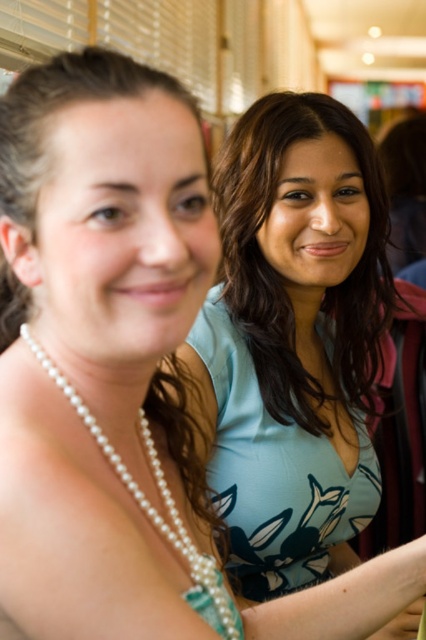
Can you confirm if pearl necklace at left is taller than pearl necklace at center?

No, pearl necklace at left is not taller than pearl necklace at center.

Is pearl necklace at left wider than pearl necklace at center?

Yes, pearl necklace at left is wider than pearl necklace at center.

Locate an element on the screen. pearl necklace at left is located at coordinates (65, 108).

This screenshot has width=426, height=640. Find the location of `pearl necklace at left`. pearl necklace at left is located at coordinates (65, 108).

Where is `matte blue blouse at center`? The image size is (426, 640). matte blue blouse at center is located at coordinates (279, 275).

Is matte blue blouse at center positioned before pearl necklace at left?

No.

Which is in front, point (322, 310) or point (31, 195)?

Positioned in front is point (31, 195).

Identify the location of matte blue blouse at center. The width and height of the screenshot is (426, 640). (279, 275).

Which is more to the left, matte blue blouse at center or pearl necklace at center?

pearl necklace at center

Which is below, matte blue blouse at center or pearl necklace at center?

pearl necklace at center

Which is in front, point (232, 282) or point (213, 593)?

Point (213, 593)

You are a GUI agent. You are given a task and a screenshot of the screen. Output one action in this format:
    pyautogui.click(x=<x>, y=<y>)
    Task: Click on the matte blue blouse at center
    Image resolution: width=426 pixels, height=640 pixels.
    Given the screenshot: What is the action you would take?
    pyautogui.click(x=279, y=275)